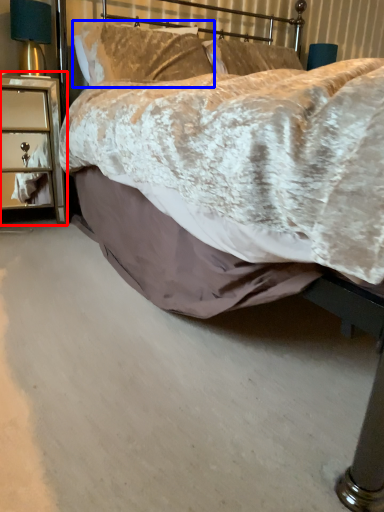
Question: Which point is closer to the camera, nightstand (highlighted by a red box) or pillow (highlighted by a blue box)?

Choices:
 (A) nightstand
 (B) pillow

Answer: (A)